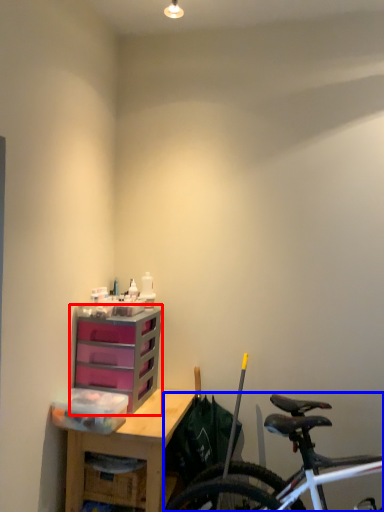
Question: Which point is further to the camera, chest of drawers (highlighted by a red box) or bicycle (highlighted by a blue box)?

Choices:
 (A) chest of drawers
 (B) bicycle

Answer: (A)